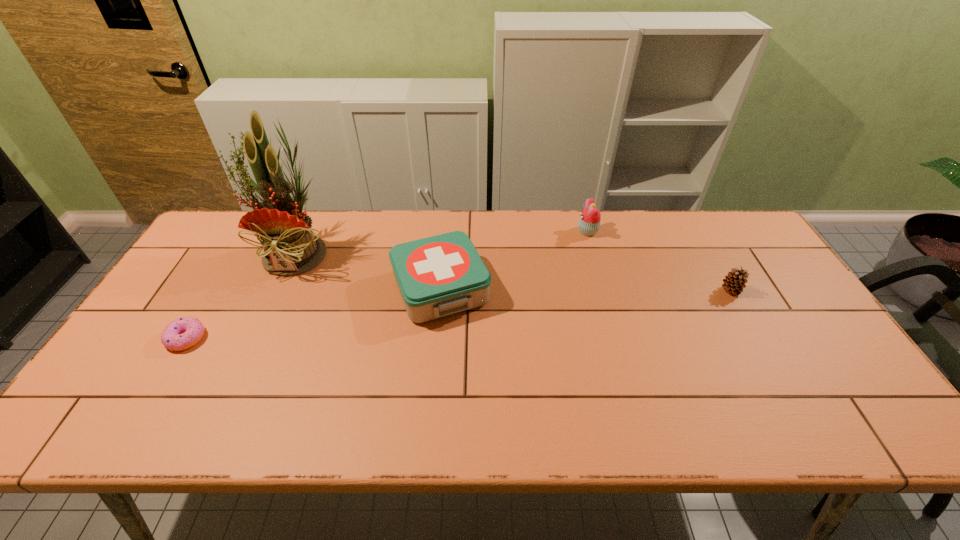
Image resolution: width=960 pixels, height=540 pixels. In order to click on free space between the cupcake and the third object from right to left in this screenshot , I will do `click(515, 260)`.

Locate an element on the screen. object that can be found as the second closest to the rightmost object is located at coordinates (437, 276).

This screenshot has height=540, width=960. I want to click on object that stands as the third closest to the cupcake, so click(x=291, y=248).

In order to click on vacant space that satisfies the following two spatial constraints: 1. in front of the third object from right to left with the fan visible; 2. on the left side of the flower arrangement in this screenshot , I will do `click(282, 288)`.

The image size is (960, 540). In order to click on vacant space that satisfies the following two spatial constraints: 1. on the face of the fourth object from left to right; 2. in front of the second object from left to right with the fan visible in this screenshot , I will do `click(593, 251)`.

You are a GUI agent. You are given a task and a screenshot of the screen. Output one action in this format:
    pyautogui.click(x=<x>, y=<y>)
    Task: Click on the free point that satisfies the following two spatial constraints: 1. in front of the second object from left to right with the fan visible; 2. on the left side of the third object from right to left
    The image size is (960, 540).
    Given the screenshot: What is the action you would take?
    point(282,288)

This screenshot has width=960, height=540. I want to click on free region that satisfies the following two spatial constraints: 1. on the face of the rightmost object; 2. on the right side of the second object from right to left, so click(x=605, y=291).

At what (x,y) coordinates should I click in order to perform the action: click on vacant space that satisfies the following two spatial constraints: 1. on the face of the second object from right to left; 2. on the back side of the rightmost object. Please return your answer as a coordinate pair (x, y). Image resolution: width=960 pixels, height=540 pixels. Looking at the image, I should click on (605, 291).

At what (x,y) coordinates should I click in order to perform the action: click on vacant region that satisfies the following two spatial constraints: 1. on the back side of the first-aid kit; 2. on the right side of the doughnut. Please return your answer as a coordinate pair (x, y). This screenshot has height=540, width=960. Looking at the image, I should click on (216, 288).